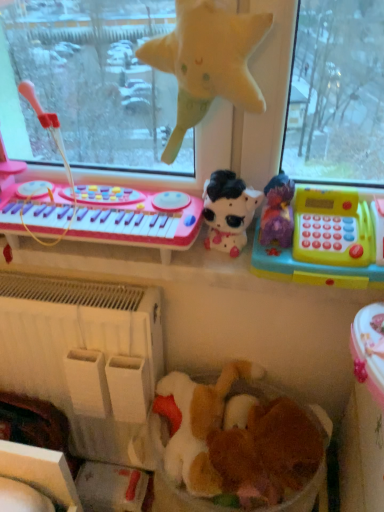
This screenshot has width=384, height=512. I want to click on free space that is to the left of plush black and white cow at center, arranged as the 2th toy when viewed from the top, so click(x=168, y=262).